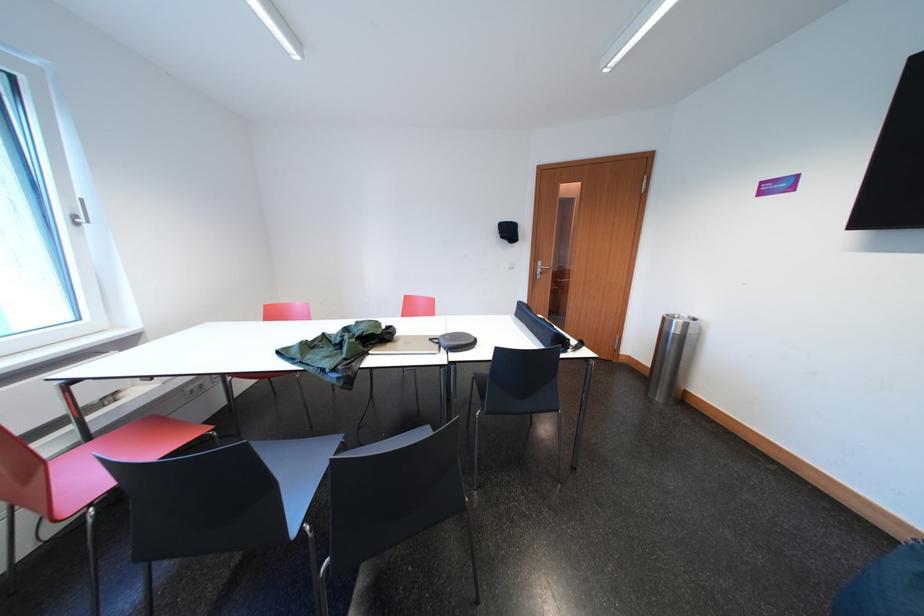
The height and width of the screenshot is (616, 924). In order to click on silver door handle in this screenshot , I will do `click(546, 265)`.